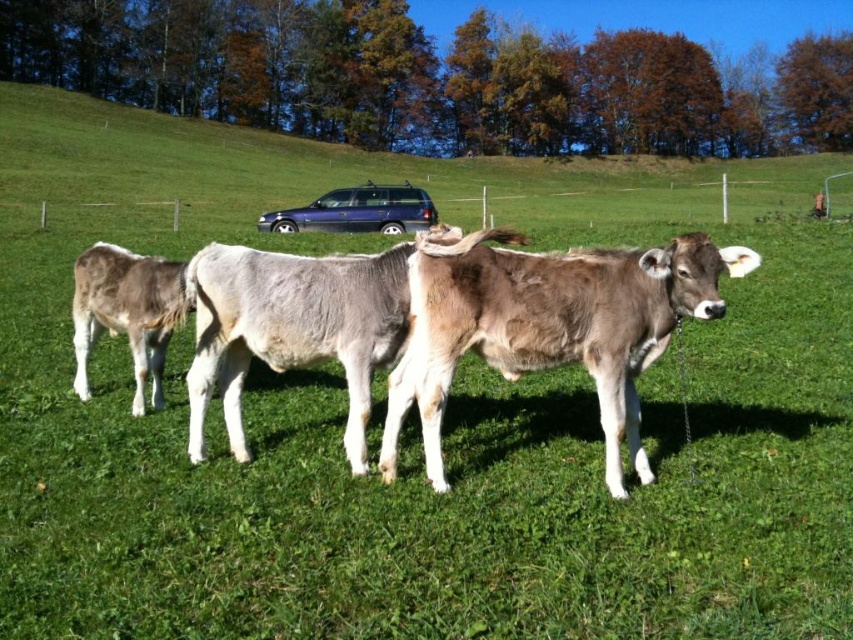
Can you confirm if brown matte cow at center is taller than metallic blue suv at center?

No.

Which is more to the right, brown matte cow at center or metallic blue suv at center?

From the viewer's perspective, brown matte cow at center appears more on the right side.

You are a GUI agent. You are given a task and a screenshot of the screen. Output one action in this format:
    pyautogui.click(x=<x>, y=<y>)
    Task: Click on the brown matte cow at center
    
    Given the screenshot: What is the action you would take?
    pyautogui.click(x=291, y=326)

Consider the image. Which is more to the right, brown fuzzy cow at center or gray smooth calf at left?

From the viewer's perspective, brown fuzzy cow at center appears more on the right side.

Is point (424, 426) positioned in front of point (138, 378)?

Yes, it is in front of point (138, 378).

I want to click on brown fuzzy cow at center, so click(x=549, y=326).

Who is more forward, (x=119, y=326) or (x=397, y=228)?

Positioned in front is point (x=119, y=326).

Is gray smooth calf at left to the left of metallic blue suv at center from the viewer's perspective?

No, gray smooth calf at left is not to the left of metallic blue suv at center.

What do you see at coordinates (125, 312) in the screenshot?
I see `gray smooth calf at left` at bounding box center [125, 312].

Image resolution: width=853 pixels, height=640 pixels. Find the location of `gray smooth calf at left`. gray smooth calf at left is located at coordinates (125, 312).